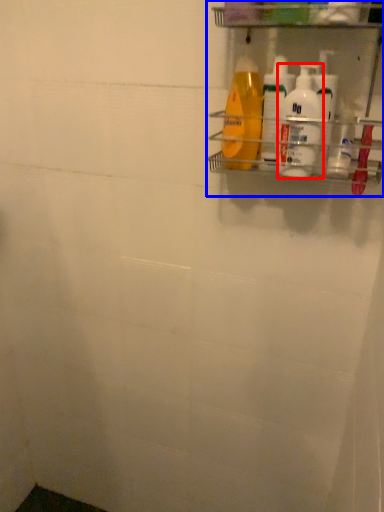
Question: Which point is further to the camera, cleaning product (highlighted by a red box) or shelf (highlighted by a blue box)?

Choices:
 (A) cleaning product
 (B) shelf

Answer: (A)